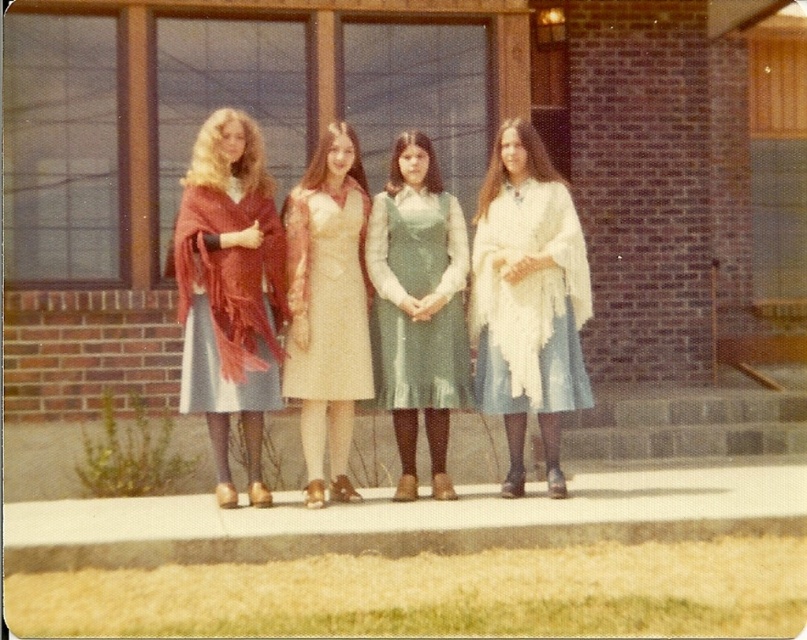
You are a photographer trying to capture a group photo of the white fringed shawl at right and the green satin dress at center. The camera you are using has a minimum focus distance of 30 centimeters. Can you focus on both subjects simultaneously without moving the camera?

The white fringed shawl at right is 33.11 centimeters away from the green satin dress at center. Since the distance between them is greater than the camera minimum focus distance of 30 centimeters, you can focus on both subjects simultaneously without moving the camera.